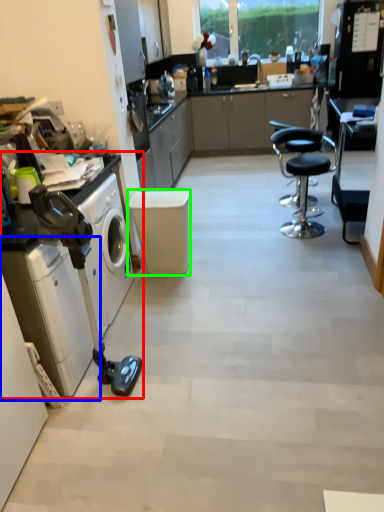
Question: Estimate the real-world distances between objects in this image. Which object is closer to home appliance (highlighted by a red box), washing machine (highlighted by a blue box) or stool (highlighted by a green box)?

Choices:
 (A) washing machine
 (B) stool

Answer: (A)